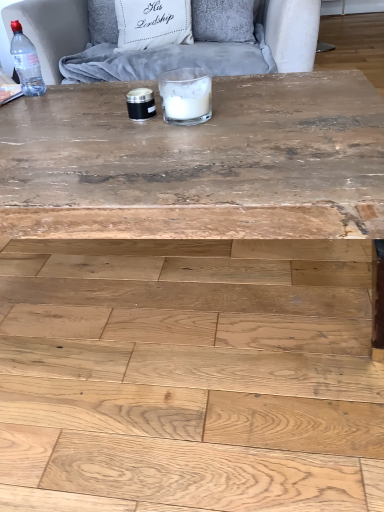
The width and height of the screenshot is (384, 512). What are the coordinates of `vacant space to the right of transparent plastic bottle at top left` in the screenshot? It's located at (78, 93).